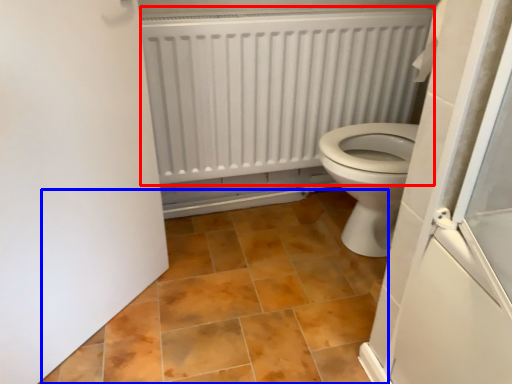
Question: Which object is closer to the camera taking this photo, radiator (highlighted by a red box) or ceramic tile (highlighted by a blue box)?

Choices:
 (A) radiator
 (B) ceramic tile

Answer: (B)